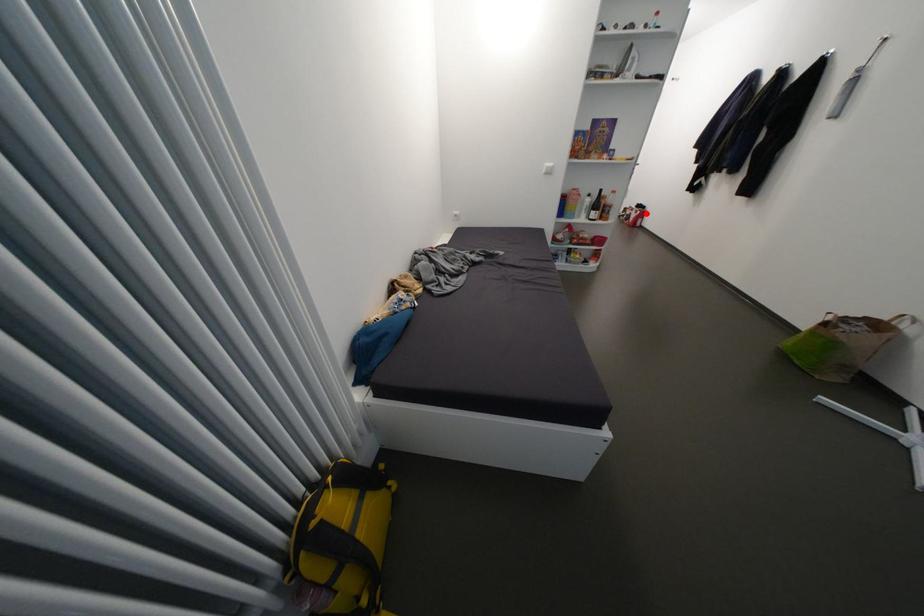
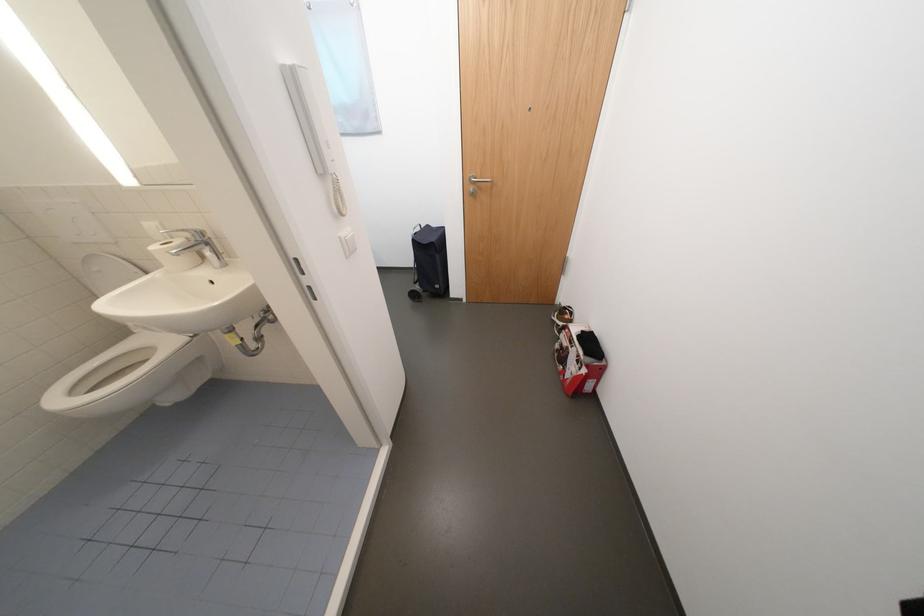
In the second image, find the point that corresponds to the highlighted location in the first image.

(592, 371)